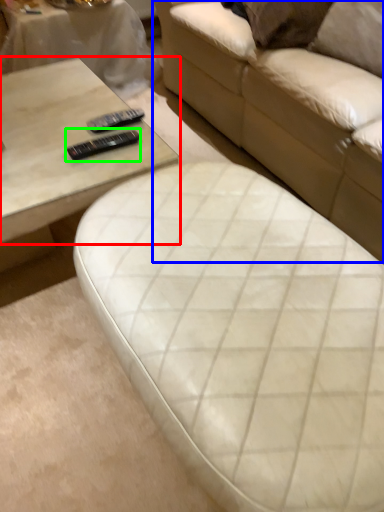
Question: Estimate the real-world distances between objects in this image. Which object is farther from coffee table (highlighted by a red box), studio couch (highlighted by a blue box) or remote (highlighted by a green box)?

Choices:
 (A) studio couch
 (B) remote

Answer: (A)